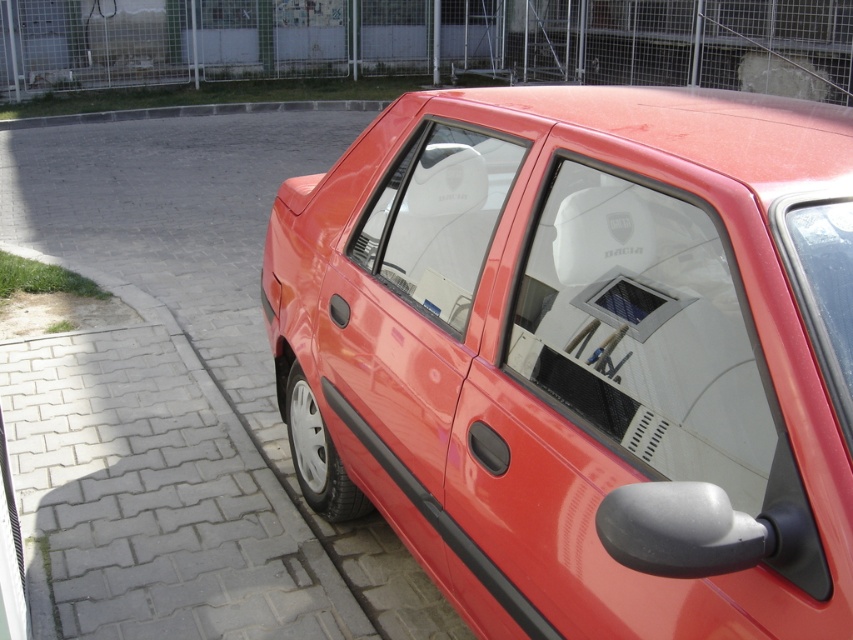
Can you confirm if transparent plastic window at center is positioned to the left of transparent glass windshield at upper right?

Correct, you'll find transparent plastic window at center to the left of transparent glass windshield at upper right.

Is point (515, 148) behind point (805, 273)?

Yes, point (515, 148) is behind point (805, 273).

The height and width of the screenshot is (640, 853). I want to click on transparent plastic window at center, so click(x=438, y=220).

The width and height of the screenshot is (853, 640). What do you see at coordinates (387, 381) in the screenshot? I see `glossy plastic car door at center` at bounding box center [387, 381].

From the picture: How distant is glossy plastic car door at center from transparent glass windshield at upper right?

1.23 meters

What do you see at coordinates (387, 381) in the screenshot?
I see `glossy plastic car door at center` at bounding box center [387, 381].

The height and width of the screenshot is (640, 853). I want to click on glossy plastic car door at center, so click(x=387, y=381).

Which of these two, transparent glass windshield at center or transparent glass windshield at upper right, stands taller?

With more height is transparent glass windshield at center.

Who is higher up, transparent glass windshield at center or transparent glass windshield at upper right?

Positioned higher is transparent glass windshield at upper right.

This screenshot has height=640, width=853. In order to click on transparent glass windshield at center in this screenshot , I will do `click(643, 332)`.

You are a GUI agent. You are given a task and a screenshot of the screen. Output one action in this format:
    pyautogui.click(x=<x>, y=<y>)
    Task: Click on the transparent glass windshield at center
    
    Given the screenshot: What is the action you would take?
    pyautogui.click(x=643, y=332)